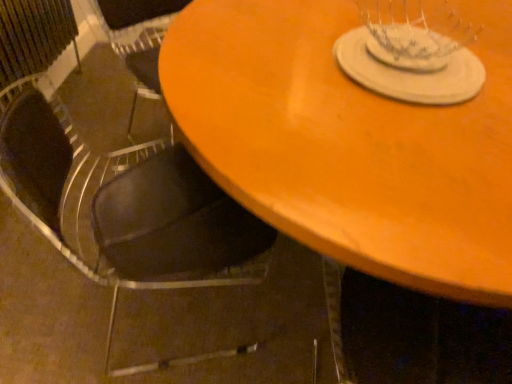
Question: Considering the positions of wooden table at center and white matte glass plate at upper center in the image, is wooden table at center wider or thinner than white matte glass plate at upper center?

Choices:
 (A) thin
 (B) wide

Answer: (B)

Question: From the image's perspective, is wooden table at center positioned above or below white matte glass plate at upper center?

Choices:
 (A) above
 (B) below

Answer: (B)

Question: Estimate the real-world distances between objects in this image. Which object is closer to the wooden table at center?

Choices:
 (A) white matte glass plate at upper center
 (B) black leather chair at lower left

Answer: (A)

Question: Considering the real-world distances, which object is closest to the white matte glass plate at upper center?

Choices:
 (A) wooden table at center
 (B) black leather chair at lower left

Answer: (A)